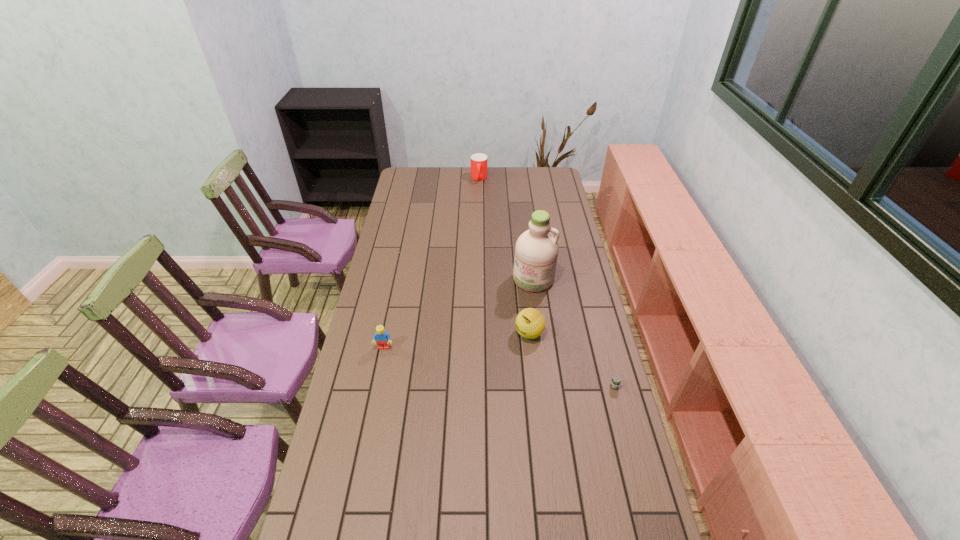
This screenshot has width=960, height=540. I want to click on free space between the farthest object and the Lego, so click(x=431, y=263).

Locate an element on the screen. free space between the rightmost object and the tallest object is located at coordinates (574, 333).

The image size is (960, 540). I want to click on unoccupied position between the second farthest object and the leftmost object, so click(x=459, y=313).

This screenshot has height=540, width=960. I want to click on free space between the shortest object and the leftmost object, so click(x=499, y=367).

Where is `vacant area that lies between the cup and the cleansing agent`? The image size is (960, 540). vacant area that lies between the cup and the cleansing agent is located at coordinates tap(506, 229).

The width and height of the screenshot is (960, 540). In order to click on free space between the Lego and the softball in this screenshot , I will do `click(457, 340)`.

Where is `free spot between the softball and the rightmost object`? free spot between the softball and the rightmost object is located at coordinates (572, 360).

Choose which object is the third nearest neighbor to the softball. Please provide its 2D coordinates. Your answer should be formatted as a tuple, i.e. [(x, y)], where the tuple contains the x and y coordinates of a point satisfying the conditions above.

[(382, 338)]

Locate an element on the screen. the fourth closest object to the softball is located at coordinates (479, 161).

The width and height of the screenshot is (960, 540). I want to click on vacant space that satisfies the following two spatial constraints: 1. on the front side of the softball; 2. on the right side of the cup, so click(x=479, y=333).